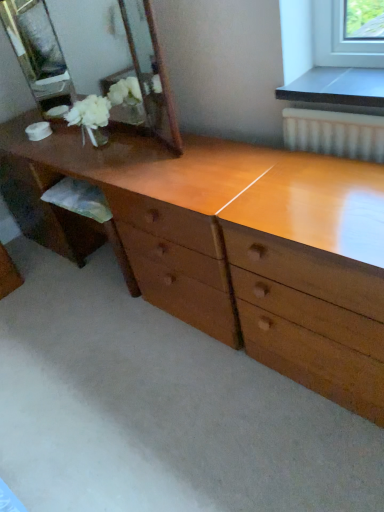
In order to click on wooden mirror at upper left in this screenshot , I will do `click(92, 56)`.

This screenshot has width=384, height=512. What do you see at coordinates (92, 56) in the screenshot? I see `wooden mirror at upper left` at bounding box center [92, 56].

Image resolution: width=384 pixels, height=512 pixels. Find the location of `wooden dresser at center`. wooden dresser at center is located at coordinates (243, 247).

Image resolution: width=384 pixels, height=512 pixels. Describe the element at coordinates (243, 247) in the screenshot. I see `wooden dresser at center` at that location.

Find the location of a particular element. The image size is (384, 512). wooden mirror at upper left is located at coordinates (92, 56).

From the picture: Is wooden dresser at center to the left or to the right of wooden mirror at upper left in the image?

From the image, it's evident that wooden dresser at center is to the right of wooden mirror at upper left.

Is wooden dresser at center positioned behind wooden mirror at upper left?

No, it is not.

Does point (108, 186) come behind point (161, 88)?

No, it is in front of (161, 88).

From the image's perspective, relative to wooden mirror at upper left, is wooden dresser at center above or below?

Clearly, from the image's perspective, wooden dresser at center is below wooden mirror at upper left.

From a real-world perspective, is wooden dresser at center below wooden mirror at upper left?

Indeed, from a real-world perspective, wooden dresser at center is positioned beneath wooden mirror at upper left.

Considering the relative sizes of wooden dresser at center and wooden mirror at upper left in the image provided, is wooden dresser at center wider than wooden mirror at upper left?

Yes.

From their relative heights in the image, would you say wooden dresser at center is taller or shorter than wooden mirror at upper left?

Considering their sizes, wooden dresser at center has more height than wooden mirror at upper left.

Considering the sizes of wooden dresser at center and wooden mirror at upper left in the image, is wooden dresser at center bigger or smaller than wooden mirror at upper left?

wooden dresser at center is bigger than wooden mirror at upper left.

Is wooden dresser at center positioned beyond the bounds of wooden mirror at upper left?

wooden dresser at center lies outside wooden mirror at upper left's area.

Are wooden dresser at center and wooden mirror at upper left located far from each other?

That's right, there is a large distance between wooden dresser at center and wooden mirror at upper left.

Does wooden dresser at center turn towards wooden mirror at upper left?

No.

What's the angular difference between wooden dresser at center and wooden mirror at upper left's facing directions?

wooden dresser at center and wooden mirror at upper left are facing 0.325 degrees away from each other.

Identify the location of chest of drawers below the wooden mirror at upper left (from a real-world perspective). (243, 247).

Is wooden mirror at upper left at the left side of wooden dresser at center?

Yes, wooden mirror at upper left is to the left of wooden dresser at center.

In the image, is wooden mirror at upper left positioned in front of or behind wooden dresser at center?

wooden mirror at upper left is behind wooden dresser at center.

Looking at this image, which is further, (151,38) or (138,207)?

Point (138,207)

Looking at this image, from the image's perspective, is wooden mirror at upper left on wooden dresser at center?

Indeed, from the image's perspective, wooden mirror at upper left is shown above wooden dresser at center.

From a real-world perspective, is wooden mirror at upper left physically located above or below wooden dresser at center?

wooden mirror at upper left is above wooden dresser at center.

Considering the sizes of wooden mirror at upper left and wooden dresser at center in the image, is wooden mirror at upper left wider or thinner than wooden dresser at center?

Considering their sizes, wooden mirror at upper left looks slimmer than wooden dresser at center.

Is wooden mirror at upper left taller than wooden dresser at center?

Incorrect, the height of wooden mirror at upper left is not larger of that of wooden dresser at center.

Who is smaller, wooden mirror at upper left or wooden dresser at center?

With smaller size is wooden mirror at upper left.

Is wooden mirror at upper left completely or partially outside of wooden dresser at center?

wooden mirror at upper left lies outside wooden dresser at center's area.

Would you say wooden mirror at upper left is a long distance from wooden dresser at center?

Absolutely, wooden mirror at upper left is distant from wooden dresser at center.

Is wooden mirror at upper left positioned with its back to wooden dresser at center?

No.

Can you tell me how much wooden mirror at upper left and wooden dresser at center differ in facing direction?

The facing directions of wooden mirror at upper left and wooden dresser at center are 0.325 degrees apart.

How far apart are wooden mirror at upper left and wooden dresser at center?

They are 4.13 feet apart.

Find the location of a particular element. The width and height of the screenshot is (384, 512). mirror above the wooden dresser at center (from a real-world perspective) is located at coordinates (92, 56).

In the image, there is a wooden dresser at center. At what (x,y) coordinates should I click in order to perform the action: click on mirror above it (from the image's perspective). Please return your answer as a coordinate pair (x, y). Image resolution: width=384 pixels, height=512 pixels. Looking at the image, I should click on (92, 56).

Where is `mirror on the left of the wooden dresser at center`? The height and width of the screenshot is (512, 384). mirror on the left of the wooden dresser at center is located at coordinates (92, 56).